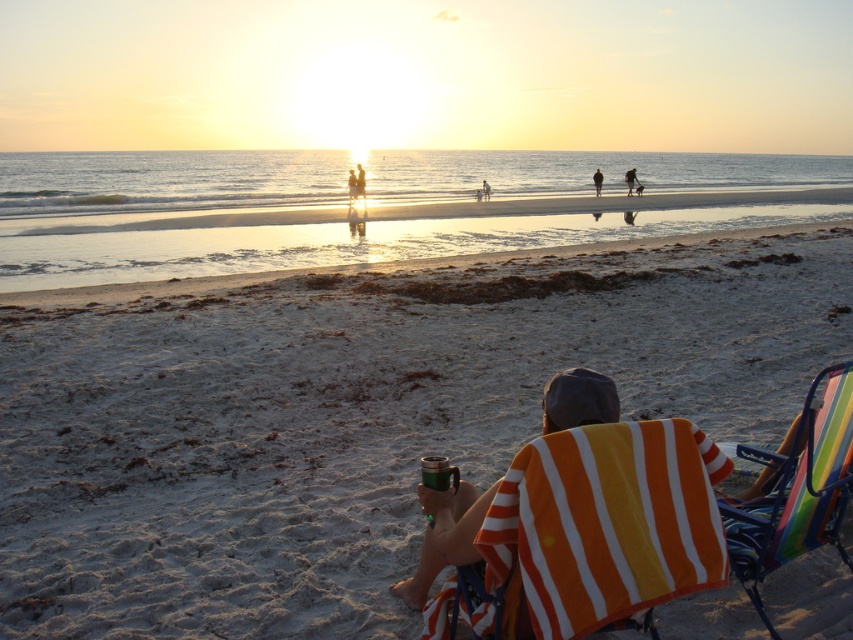
Can you confirm if white sandy beach at center is taller than smooth skin person at center?

Yes, white sandy beach at center is taller than smooth skin person at center.

Between white sandy beach at center and smooth skin person at center, which one is positioned lower?

white sandy beach at center is lower down.

Looking at this image, who is more distant from viewer, (x=129, y=595) or (x=363, y=189)?

Point (x=363, y=189)

What are the coordinates of `white sandy beach at center` in the screenshot? It's located at (352, 416).

Looking at this image, is light brown sand at center wider than dark brown leather jacket at upper center?

Indeed, light brown sand at center has a greater width compared to dark brown leather jacket at upper center.

Is light brown sand at center thinner than dark brown leather jacket at upper center?

No, light brown sand at center is not thinner than dark brown leather jacket at upper center.

Describe the element at coordinates (631, 180) in the screenshot. I see `light brown sand at center` at that location.

You are a GUI agent. You are given a task and a screenshot of the screen. Output one action in this format:
    pyautogui.click(x=<x>, y=<y>)
    Task: Click on the light brown sand at center
    This screenshot has height=640, width=853.
    Given the screenshot: What is the action you would take?
    pyautogui.click(x=631, y=180)

Is white sandy beach at center wider than green matte mug at center?

Yes.

Which of these two, white sandy beach at center or green matte mug at center, stands taller?

white sandy beach at center

At what (x,y) coordinates should I click in order to perform the action: click on white sandy beach at center. Please return your answer as a coordinate pair (x, y). This screenshot has width=853, height=640. Looking at the image, I should click on (352, 416).